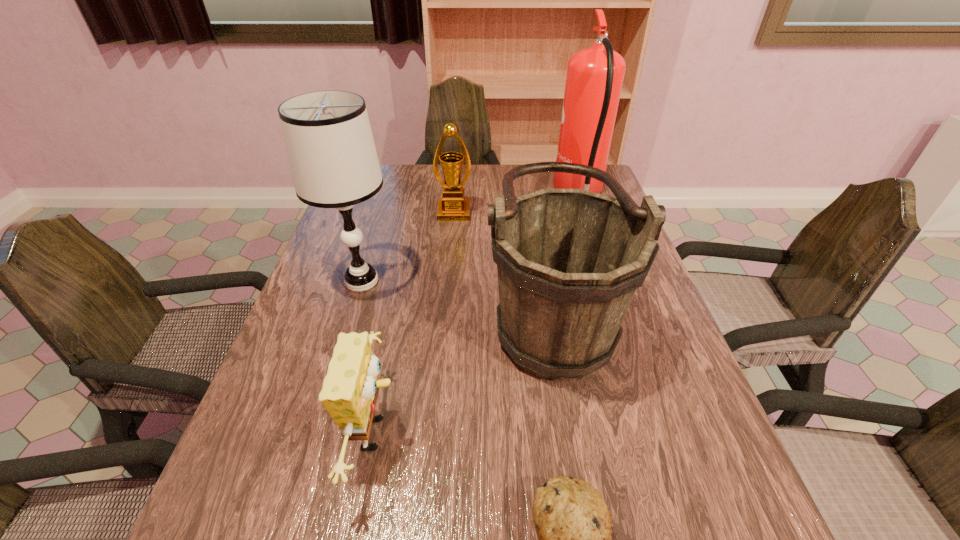
In the image, there is a desktop. Where is `free space at the far edge`? This screenshot has height=540, width=960. free space at the far edge is located at coordinates (431, 170).

In order to click on vacant space at the left edge of the desktop in this screenshot , I will do `click(318, 315)`.

In the image, there is a desktop. Identify the location of free region at the right edge. This screenshot has height=540, width=960. (672, 478).

You are a GUI agent. You are given a task and a screenshot of the screen. Output one action in this format:
    pyautogui.click(x=<x>, y=<y>)
    Task: Click on the vacant space at the far left corner of the desktop
    The height and width of the screenshot is (540, 960).
    Given the screenshot: What is the action you would take?
    pyautogui.click(x=403, y=165)

Where is `vacant space that is in between the bucket and the sponge`? vacant space that is in between the bucket and the sponge is located at coordinates (465, 374).

Find the location of a particular element. empty location between the table lamp and the fourth shortest object is located at coordinates (457, 297).

Find the location of a particular element. vacant area that lies between the award and the second shortest object is located at coordinates (416, 323).

The image size is (960, 540). In order to click on vacant space that's between the fire extinguisher and the sponge in this screenshot , I will do `click(479, 314)`.

The image size is (960, 540). I want to click on free point between the table lamp and the fourth object from right to left, so click(408, 247).

The image size is (960, 540). I want to click on free space that is in between the fifth tallest object and the fourth tallest object, so click(416, 323).